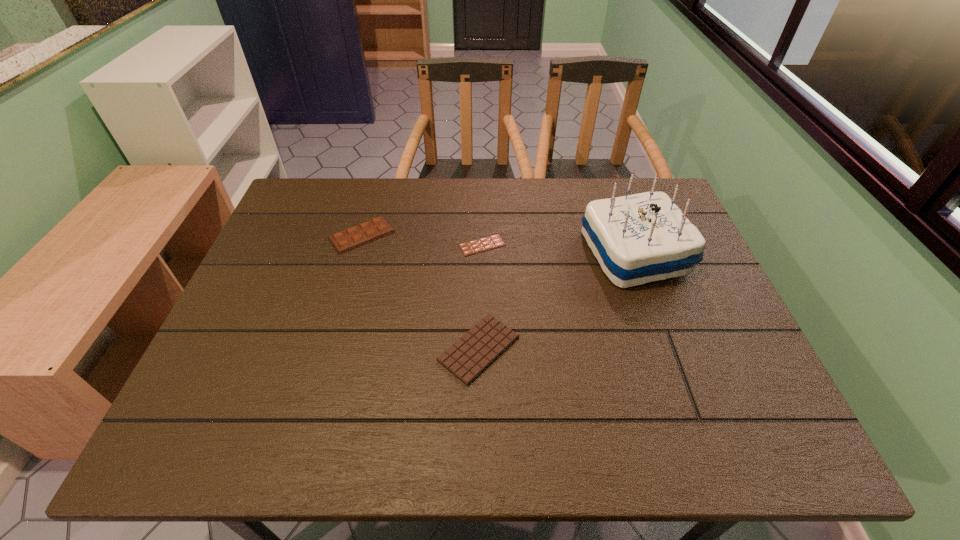
Image resolution: width=960 pixels, height=540 pixels. What are the coordinates of `the tallest object` in the screenshot? It's located at (640, 238).

Where is `birthday cake`? This screenshot has height=540, width=960. birthday cake is located at coordinates (640, 238).

Locate an element on the screen. This screenshot has height=540, width=960. the leftmost object is located at coordinates (351, 238).

The height and width of the screenshot is (540, 960). Identify the location of the tallest chocolate bar. (351, 238).

In order to click on the third tallest object in this screenshot , I will do `click(468, 357)`.

Locate an element on the screen. the nearest chocolate bar is located at coordinates (468, 357).

Where is `the shortest chocolate bar`? the shortest chocolate bar is located at coordinates (488, 243).

This screenshot has width=960, height=540. Find the location of `vacant space situated 0.370m on the front of the birthday cake`. vacant space situated 0.370m on the front of the birthday cake is located at coordinates (698, 431).

You are a GUI agent. You are given a task and a screenshot of the screen. Output one action in this format:
    pyautogui.click(x=<x>, y=<y>)
    Task: Click on the vacant space located 0.150m on the right of the tallest chocolate bar
    
    Given the screenshot: What is the action you would take?
    pyautogui.click(x=447, y=235)

Locate an element on the screen. The width and height of the screenshot is (960, 540). vacant region located on the front of the second tallest chocolate bar is located at coordinates (479, 413).